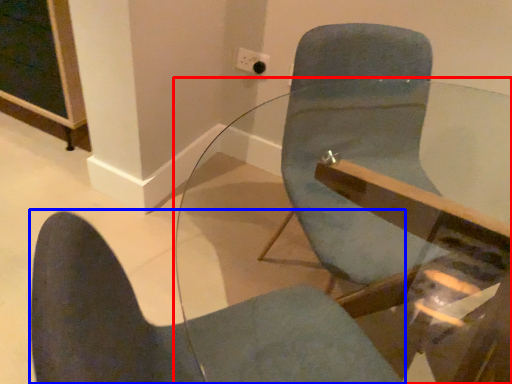
Question: Which point is closer to the camera, table (highlighted by a red box) or chair (highlighted by a blue box)?

Choices:
 (A) table
 (B) chair

Answer: (A)